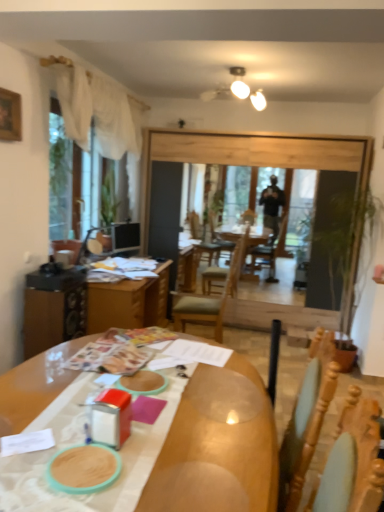
Question: Is matte black monitor at left positioned far away from transparent glass window screen at left?

Choices:
 (A) yes
 (B) no

Answer: (B)

Question: Is matte black monitor at left positioned with its back to transparent glass window screen at left?

Choices:
 (A) yes
 (B) no

Answer: (A)

Question: Is matte black monitor at left taller than transparent glass window screen at left?

Choices:
 (A) no
 (B) yes

Answer: (A)

Question: From the image's perspective, is matte black monitor at left under transparent glass window screen at left?

Choices:
 (A) no
 (B) yes

Answer: (B)

Question: Does matte black monitor at left have a lesser height compared to transparent glass window screen at left?

Choices:
 (A) yes
 (B) no

Answer: (A)

Question: Does point (54, 292) appear closer or farther from the camera than point (120, 224)?

Choices:
 (A) closer
 (B) farther

Answer: (A)

Question: Considering their positions, is wooden table at center located in front of or behind matte black monitor at left?

Choices:
 (A) behind
 (B) front

Answer: (B)

Question: Is wooden table at center bigger or smaller than matte black monitor at left?

Choices:
 (A) big
 (B) small

Answer: (A)

Question: Visually, is wooden table at center positioned to the left or to the right of matte black monitor at left?

Choices:
 (A) right
 (B) left

Answer: (A)

Question: Is point (89, 162) positioned closer to the camera than point (220, 321)?

Choices:
 (A) closer
 (B) farther

Answer: (A)

Question: Considering the positions of transparent glass window screen at left and wooden chair at center in the image, is transparent glass window screen at left wider or thinner than wooden chair at center?

Choices:
 (A) thin
 (B) wide

Answer: (A)

Question: Based on their positions, is transparent glass window screen at left located to the left or right of wooden chair at center?

Choices:
 (A) right
 (B) left

Answer: (B)

Question: Is transparent glass window screen at left bigger or smaller than wooden chair at center?

Choices:
 (A) small
 (B) big

Answer: (B)

Question: From a real-world perspective, relative to wooden picture frame at upper left, is matte black monitor at left vertically above or below?

Choices:
 (A) below
 (B) above

Answer: (A)

Question: From their relative heights in the image, would you say matte black monitor at left is taller or shorter than wooden picture frame at upper left?

Choices:
 (A) short
 (B) tall

Answer: (B)